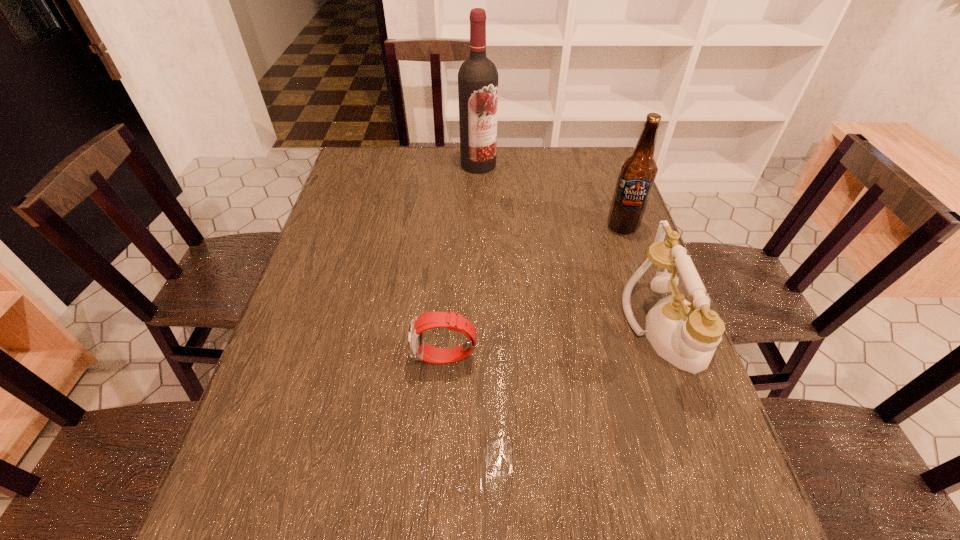
You are a GUI agent. You are given a task and a screenshot of the screen. Output one action in this format:
    pyautogui.click(x=<x>, y=<y>)
    Task: Click on the free space on the desktop that is between the shortest object and the second shortest object and is positioned on the label of the second farthest object
    The height and width of the screenshot is (540, 960).
    Given the screenshot: What is the action you would take?
    pyautogui.click(x=591, y=339)

Identify the location of vacant space on the desktop that is between the watch and the telephone and is positioned on the label of the tallest object. The width and height of the screenshot is (960, 540). (555, 344).